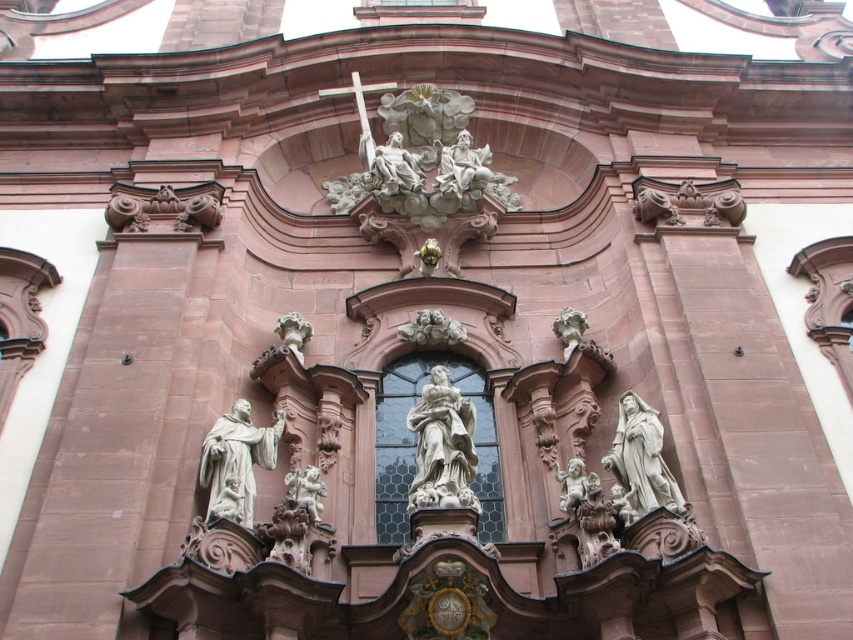
Question: Does white marble statue at center have a lesser width compared to white stone statue at center?

Choices:
 (A) yes
 (B) no

Answer: (B)

Question: Estimate the real-world distances between objects in this image. Which object is closer to the white stone statue at center?

Choices:
 (A) white marble statue at center
 (B) white stone sculpture at upper center

Answer: (A)

Question: Can you confirm if white marble statue at center is positioned to the right of white stone statue at center?

Choices:
 (A) no
 (B) yes

Answer: (A)

Question: Based on their relative distances, which object is nearer to the white stone sculpture at upper center?

Choices:
 (A) white marble statue at center
 (B) white stone statue at center

Answer: (A)

Question: Is white marble statue at center closer to camera compared to white stone statue at center?

Choices:
 (A) yes
 (B) no

Answer: (B)

Question: Which of the following is the closest to the observer?

Choices:
 (A) (412, 499)
 (B) (635, 492)
 (C) (427, 177)

Answer: (A)